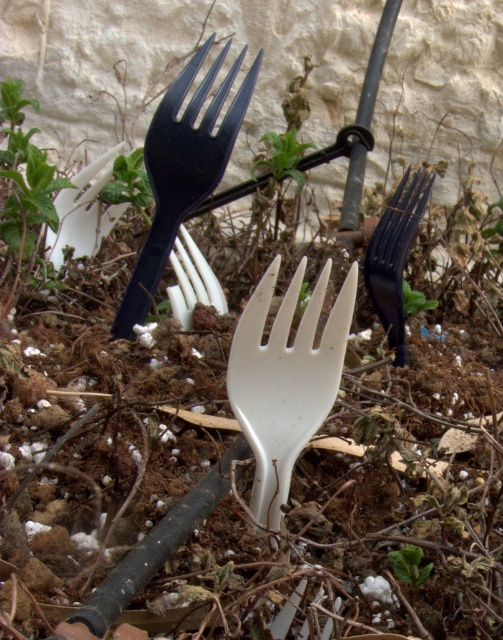
Is white matte fork at center smaller than white plastic fork at center?

Indeed, white matte fork at center has a smaller size compared to white plastic fork at center.

Is white matte fork at center positioned before white plastic fork at center?

Yes, white matte fork at center is closer to the viewer.

Identify the location of white matte fork at center. (286, 380).

Who is more forward, (x=243, y=342) or (x=395, y=564)?

Point (x=243, y=342)

Is white matte fork at center closer to camera compared to green leafy weed at lower center?

That is True.

In order to click on white matte fork at center in this screenshot , I will do `click(286, 380)`.

The height and width of the screenshot is (640, 503). Find the location of `white matte fork at center`. white matte fork at center is located at coordinates (286, 380).

Is point (163, 225) closer to camera compared to point (413, 556)?

That is False.

Is black plastic fork at upper left to the right of green leafy weed at lower center from the viewer's perspective?

No, black plastic fork at upper left is not to the right of green leafy weed at lower center.

Which is in front, point (142, 269) or point (407, 572)?

Point (407, 572)

Where is `black plastic fork at upper left`? The height and width of the screenshot is (640, 503). black plastic fork at upper left is located at coordinates (183, 168).